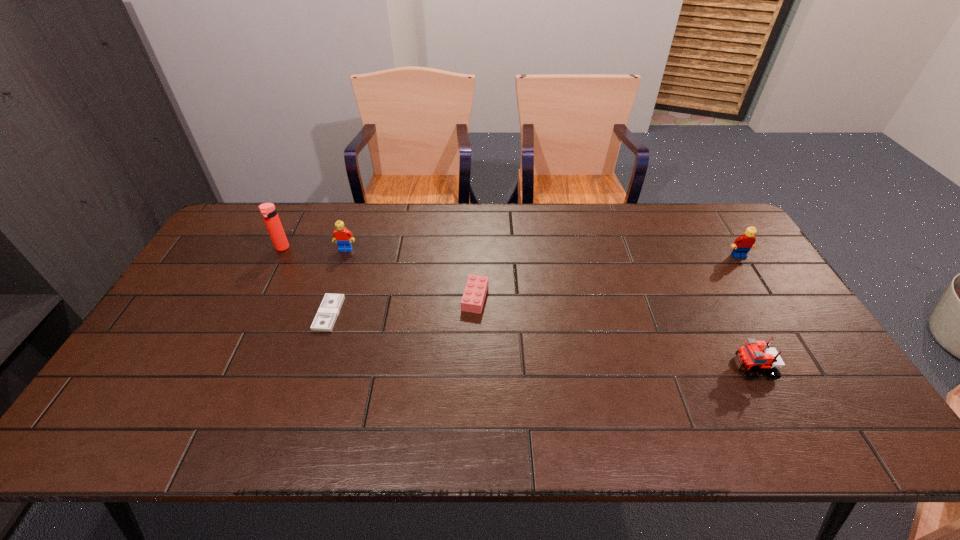
In the image, there is a desktop. Where is `free region at the far edge`? free region at the far edge is located at coordinates (601, 242).

The height and width of the screenshot is (540, 960). In the image, there is a desktop. Identify the location of free space at the near edge. (402, 423).

In the image, there is a desktop. Where is `vacant space at the left edge`? This screenshot has height=540, width=960. vacant space at the left edge is located at coordinates (167, 361).

Where is `vacant area at the right edge`? vacant area at the right edge is located at coordinates (806, 360).

Locate an element on the screen. The width and height of the screenshot is (960, 540). blank area at the far right corner is located at coordinates (726, 244).

Where is `vacant space at the near right corner`? This screenshot has width=960, height=540. vacant space at the near right corner is located at coordinates (814, 428).

Locate an element on the screen. The image size is (960, 540). vacant space in between the leftmost Lego and the rightmost object is located at coordinates (542, 252).

Where is `free space between the second shortest object and the tallest object`? This screenshot has width=960, height=540. free space between the second shortest object and the tallest object is located at coordinates (378, 273).

I want to click on empty space between the second farthest Lego and the tallest object, so click(x=511, y=252).

This screenshot has height=540, width=960. Find the location of `free space between the second shortest object and the fifth object from left to right`. free space between the second shortest object and the fifth object from left to right is located at coordinates tap(613, 333).